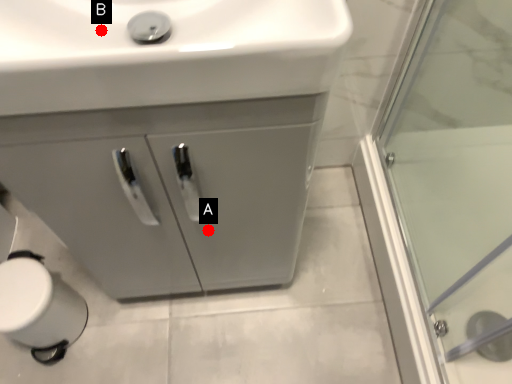
Question: Two points are circled on the image, labeled by A and B beside each circle. Which point is closer to the camera?

Choices:
 (A) A is closer
 (B) B is closer

Answer: (B)